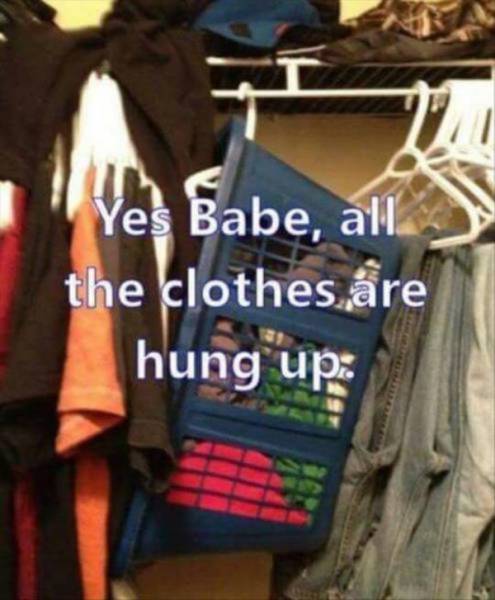
This screenshot has width=495, height=600. Find the location of `closet`. closet is located at coordinates (294, 132).